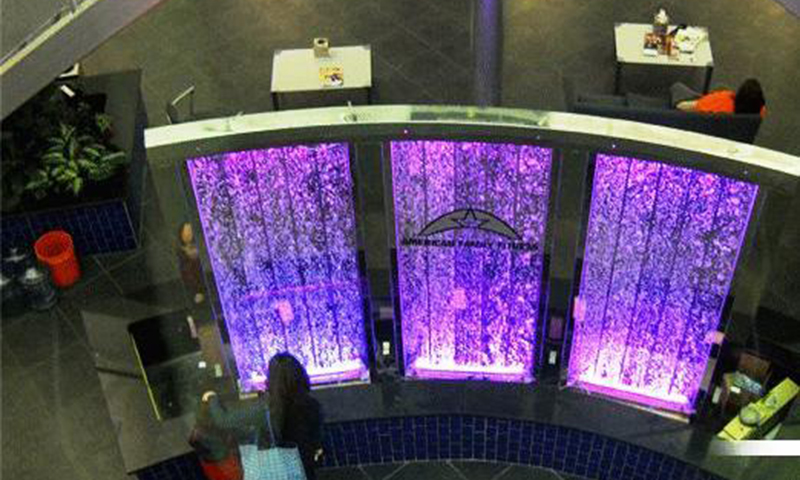
The height and width of the screenshot is (480, 800). I want to click on table, so click(x=312, y=66), click(x=626, y=37).